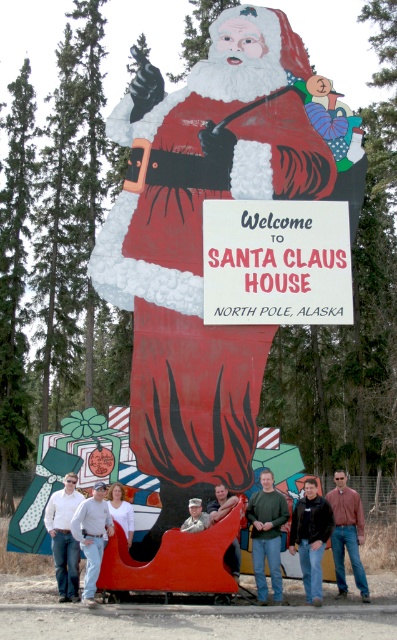
You are a photographer trying to capture the entire Santa Claus sign and the group of tourists in one shot. Given that the matte red santa claus at center is wider than the dark blue jeans at lower center, which object should you focus on to ensure both are in frame?

You should focus on the matte red santa claus at center since it is wider than the dark blue jeans at lower center, ensuring both the sign and the tourists are captured in the shot.

You are a photographer trying to capture a clear photo of both the white paper sign at center and the white cotton shirt at center. Since both are white, you need to adjust your camera settings to ensure proper exposure. Which object should you expose for first to ensure neither is overexposed?

You should expose for the white paper sign at center first because it is larger than the white cotton shirt at center, so its brightness will have a greater impact on the overall exposure.

You are a photographer trying to capture the matte red santa claus at center and the dark blue jeans at lower center in a single shot. Which object should you focus on first if you want both to be in clear focus?

You should focus on the matte red santa claus at center first because it is larger and likely closer to the camera than the dark blue jeans at lower center, ensuring both will be in focus.